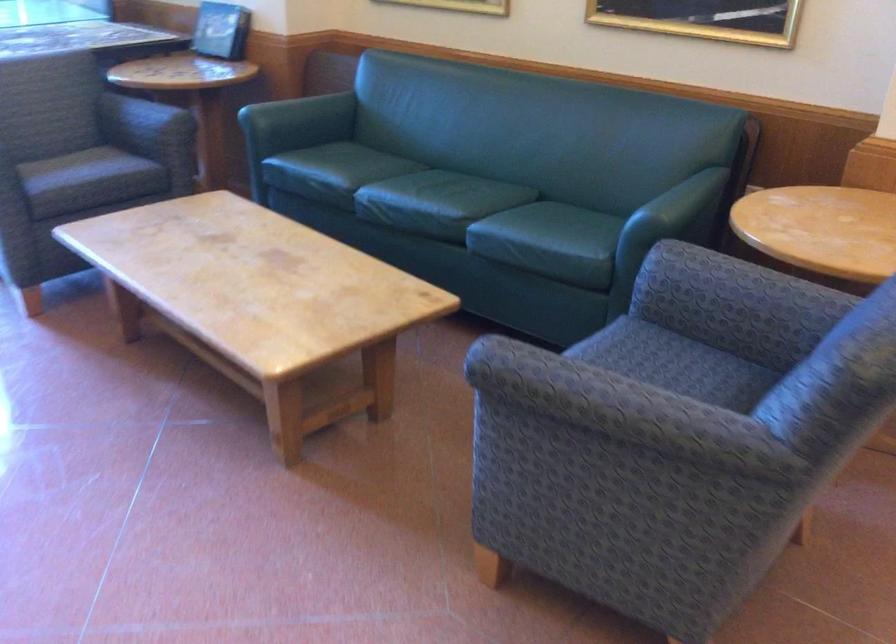
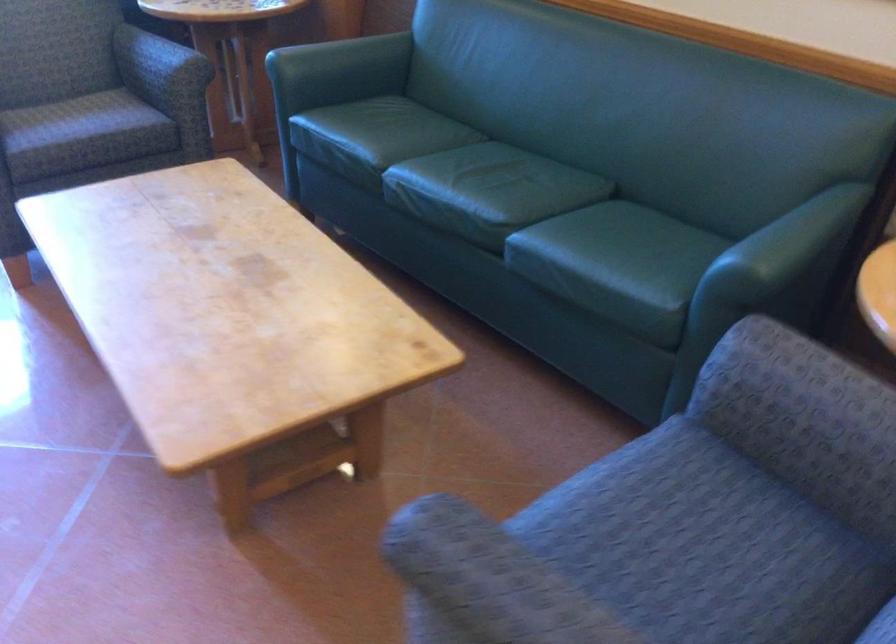
Where in the second image is the point corresponding to (74,167) from the first image?

(65, 118)